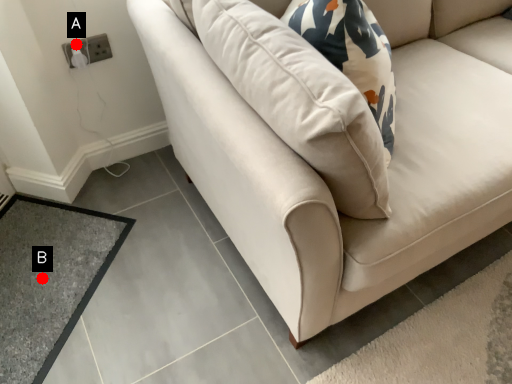
Question: Two points are circled on the image, labeled by A and B beside each circle. Which point appears closest to the camera in this image?

Choices:
 (A) A is closer
 (B) B is closer

Answer: (B)